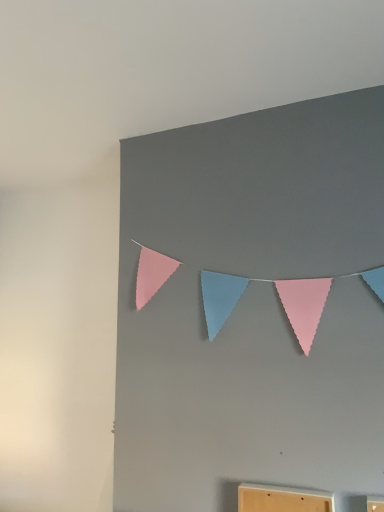
Question: Is pastel felt bunting at upper center touching wooden cabinet at lower center?

Choices:
 (A) yes
 (B) no

Answer: (B)

Question: Does pastel felt bunting at upper center lie behind wooden cabinet at lower center?

Choices:
 (A) yes
 (B) no

Answer: (A)

Question: Can you confirm if pastel felt bunting at upper center is thinner than wooden cabinet at lower center?

Choices:
 (A) yes
 (B) no

Answer: (A)

Question: Does pastel felt bunting at upper center have a larger size compared to wooden cabinet at lower center?

Choices:
 (A) yes
 (B) no

Answer: (A)

Question: Is pastel felt bunting at upper center located outside wooden cabinet at lower center?

Choices:
 (A) yes
 (B) no

Answer: (A)

Question: From the image's perspective, is pastel felt bunting at upper center located beneath wooden cabinet at lower center?

Choices:
 (A) yes
 (B) no

Answer: (B)

Question: Is wooden cabinet at lower center facing away from pastel felt bunting at upper center?

Choices:
 (A) yes
 (B) no

Answer: (B)

Question: Is wooden cabinet at lower center taller than pastel felt bunting at upper center?

Choices:
 (A) no
 (B) yes

Answer: (A)

Question: Is pastel felt bunting at upper center a part of wooden cabinet at lower center?

Choices:
 (A) yes
 (B) no

Answer: (B)

Question: Does wooden cabinet at lower center lie behind pastel felt bunting at upper center?

Choices:
 (A) no
 (B) yes

Answer: (A)

Question: Is wooden cabinet at lower center at the right side of pastel felt bunting at upper center?

Choices:
 (A) no
 (B) yes

Answer: (B)

Question: Is wooden cabinet at lower center next to pastel felt bunting at upper center and touching it?

Choices:
 (A) no
 (B) yes

Answer: (A)

Question: Considering the positions of pastel felt bunting at upper center and wooden cabinet at lower center in the image, is pastel felt bunting at upper center wider or thinner than wooden cabinet at lower center?

Choices:
 (A) thin
 (B) wide

Answer: (A)